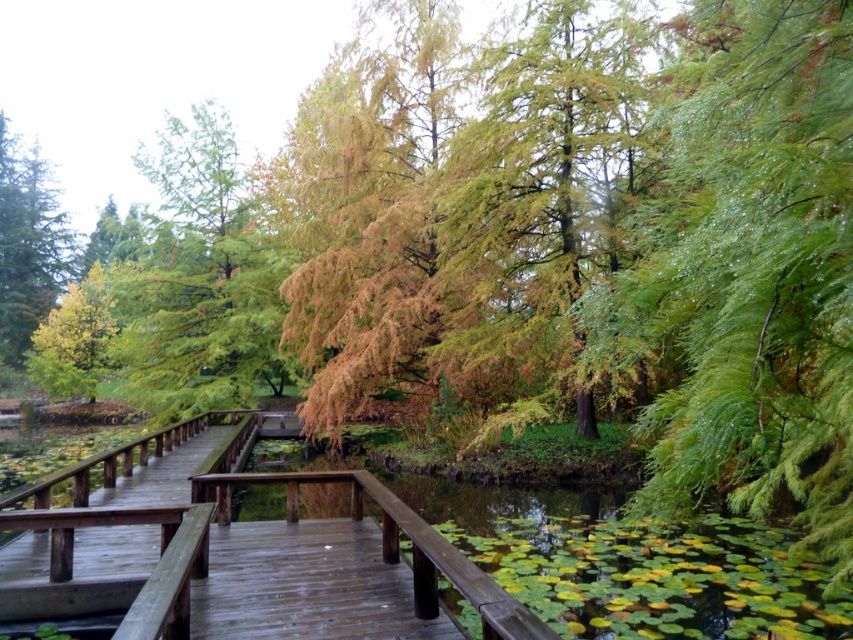
Question: Among these points, which one is nearest to the camera?

Choices:
 (A) (10, 609)
 (B) (38, 237)

Answer: (A)

Question: Which point appears farthest from the camera in this image?

Choices:
 (A) (x=71, y=385)
 (B) (x=682, y=406)
 (C) (x=16, y=340)

Answer: (C)

Question: Observing the image, what is the correct spatial positioning of green matte tree at left in reference to yellow-green foliage at left?

Choices:
 (A) right
 (B) left

Answer: (B)

Question: Which point is farther to the camera?

Choices:
 (A) (793, 449)
 (B) (85, 285)
 (C) (3, 324)
 (D) (360, 524)

Answer: (C)

Question: Is green glossy leaves at right smaller than green matte tree at left?

Choices:
 (A) no
 (B) yes

Answer: (B)

Question: Does green glossy leaves at right lie behind yellow-green foliage at left?

Choices:
 (A) no
 (B) yes

Answer: (A)